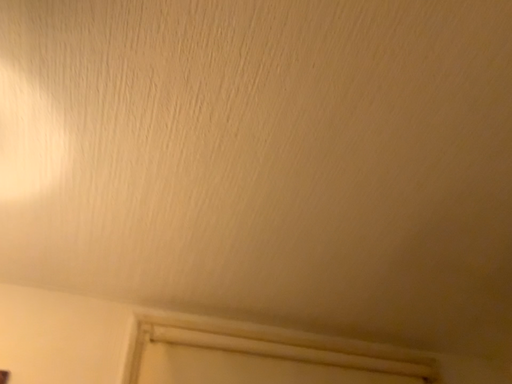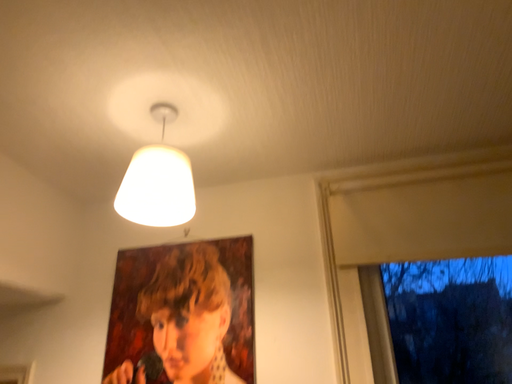
Question: How did the camera likely rotate when shooting the video?

Choices:
 (A) rotated right
 (B) rotated left

Answer: (B)